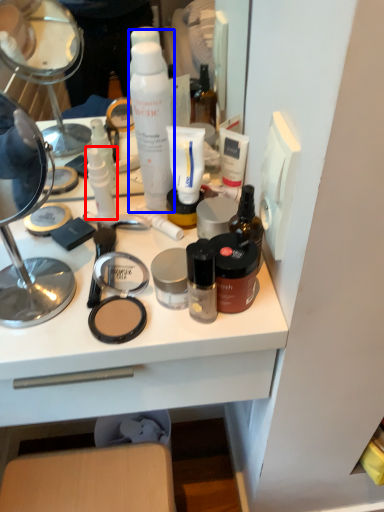
Question: Among these objects, which one is farthest to the camera, toiletry (highlighted by a red box) or shaving cream (highlighted by a blue box)?

Choices:
 (A) toiletry
 (B) shaving cream

Answer: (A)